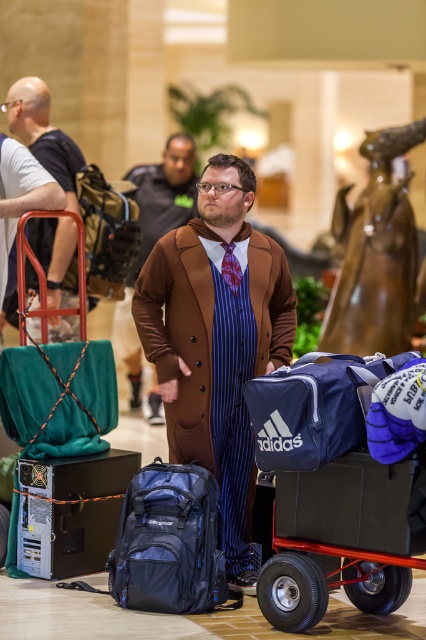
Is blue fabric backpack at center wider than brown leather coat at center?

Yes.

Which of these two, blue fabric backpack at center or brown leather coat at center, stands taller?

brown leather coat at center is taller.

Where is `blue fabric backpack at center`? blue fabric backpack at center is located at coordinates (169, 544).

Based on the photo, who is more forward, (x=123, y=572) or (x=296, y=442)?

Point (x=296, y=442) is in front.

Does point (178, 518) come farther from viewer compared to point (255, 419)?

Yes, point (178, 518) is behind point (255, 419).

I want to click on blue fabric backpack at center, so click(x=169, y=544).

Locate an element on the screen. blue fabric backpack at center is located at coordinates (169, 544).

Can you confirm if camouflage fabric backpack at center is positioned above bald man at left?

Yes, camouflage fabric backpack at center is above bald man at left.

Which is in front, point (126, 253) or point (31, 99)?

Point (126, 253) is more forward.

Image resolution: width=426 pixels, height=640 pixels. In order to click on camouflage fabric backpack at center in this screenshot , I will do `click(108, 230)`.

Image resolution: width=426 pixels, height=640 pixels. In order to click on camouflage fabric backpack at center in this screenshot , I will do `click(108, 230)`.